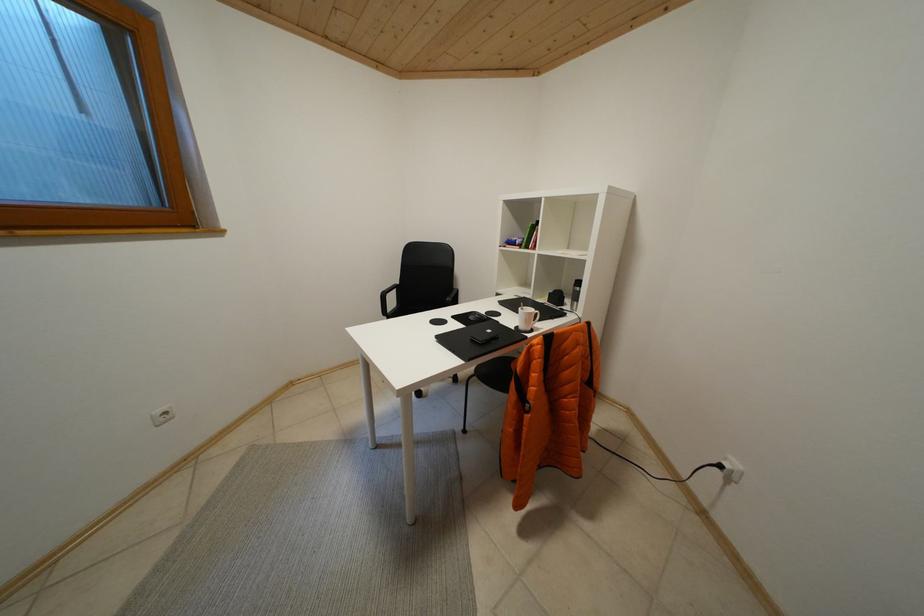
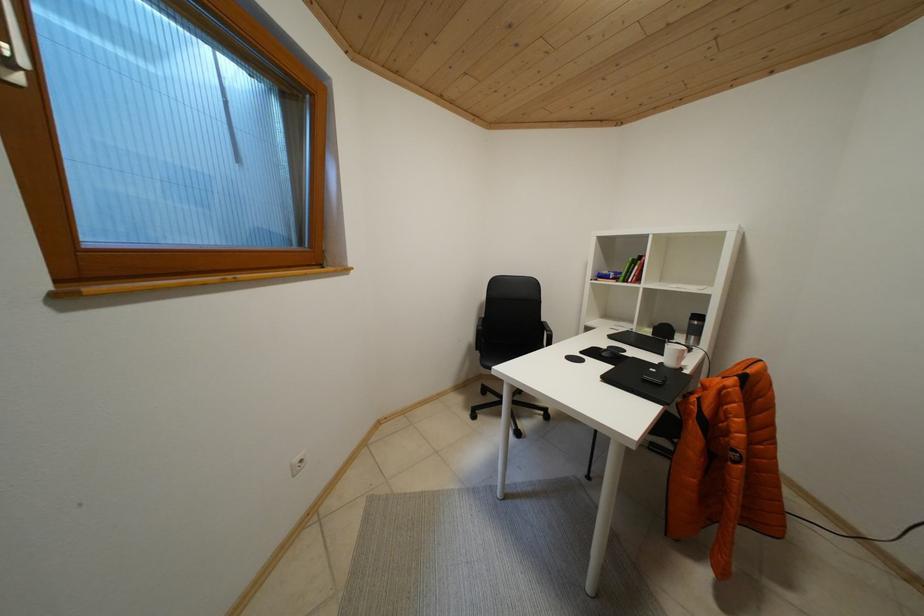
Question: In a continuous first-person perspective shot, in which direction is the camera moving?

Choices:
 (A) Left
 (B) Right
 (C) Forward
 (D) Backward

Answer: (A)